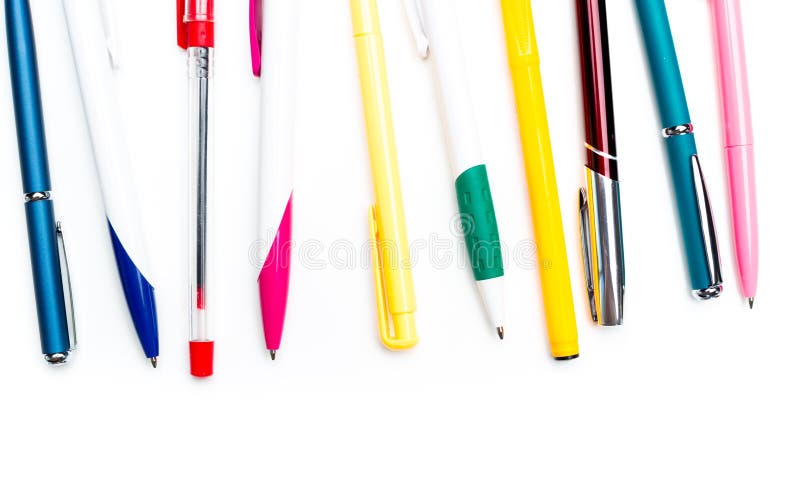
I want to click on writing tools, so click(x=54, y=285), click(x=133, y=260), click(x=198, y=247), click(x=269, y=249), click(x=390, y=257), click(x=478, y=248), click(x=554, y=251), click(x=608, y=242), click(x=702, y=231), click(x=746, y=233).